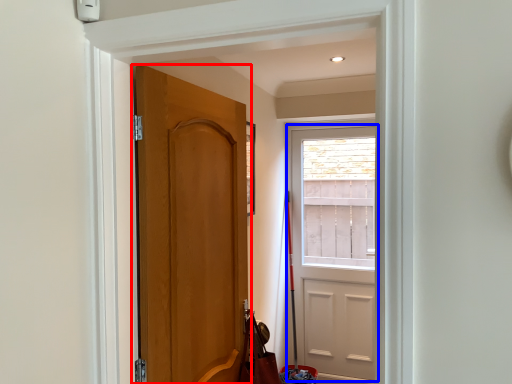
Question: Which point is further to the camera, door (highlighted by a red box) or door (highlighted by a blue box)?

Choices:
 (A) door
 (B) door

Answer: (B)